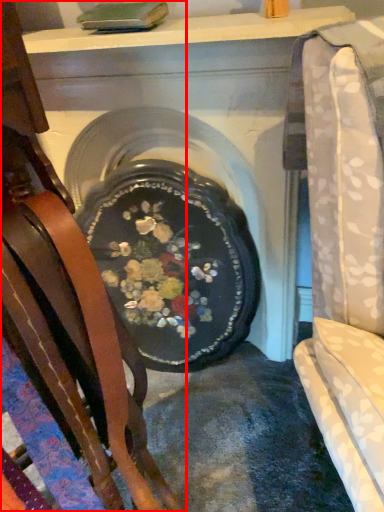
Question: From the image's perspective, what is the correct spatial relationship of chair (annotated by the red box) in relation to fireplace?

Choices:
 (A) below
 (B) above

Answer: (A)